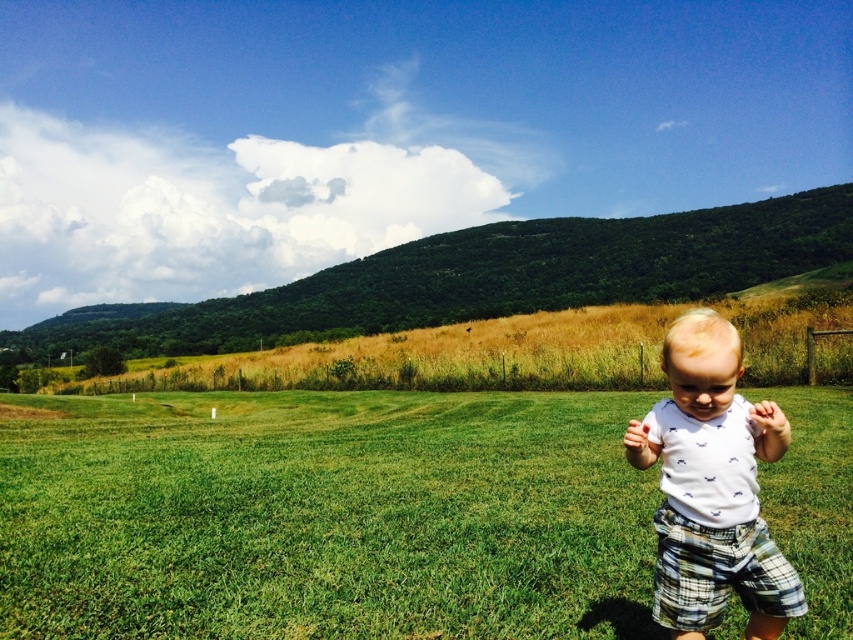
You are standing in the middle of the grassy field and see two points in the scene. One is at point (573, 452) and the other is at point (705, 496). Which point is closer to you?

Point (573, 452) is further to the camera than point (705, 496), so the point closer to you is point (705, 496).